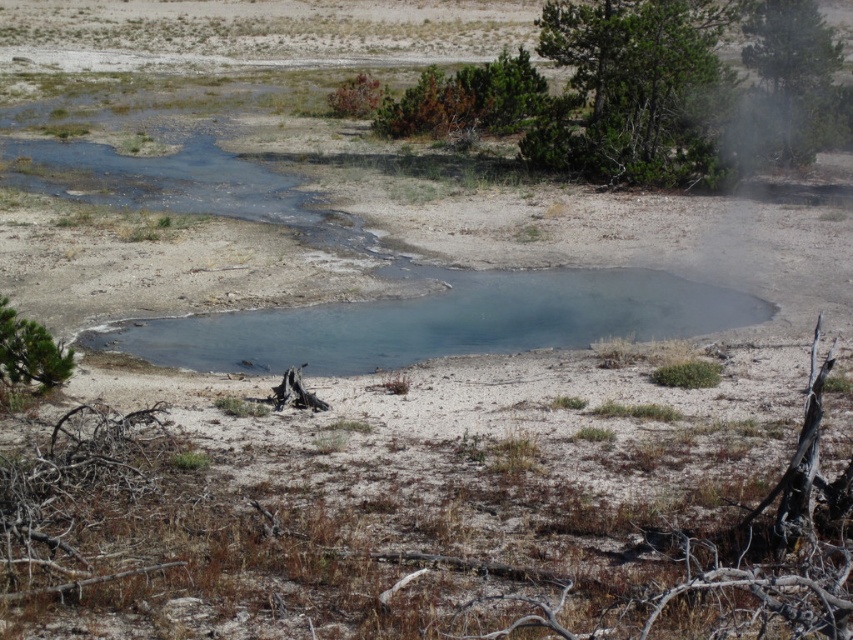
Question: Is blue clear water at center smaller than green textured tree at upper right?

Choices:
 (A) no
 (B) yes

Answer: (B)

Question: Among these objects, which one is nearest to the camera?

Choices:
 (A) green textured tree at upper right
 (B) green matte tree at lower left

Answer: (B)

Question: Among these points, which one is farthest from the camera?

Choices:
 (A) (578, 168)
 (B) (405, 323)
 (C) (33, 348)

Answer: (A)

Question: Which object is the farthest from the green matte tree at lower left?

Choices:
 (A) green textured tree at upper right
 (B) blue clear water at center

Answer: (A)

Question: Does green textured tree at upper right have a smaller size compared to green leafy tree at upper right?

Choices:
 (A) no
 (B) yes

Answer: (B)

Question: Can you confirm if green textured tree at upper right is thinner than green matte tree at lower left?

Choices:
 (A) no
 (B) yes

Answer: (A)